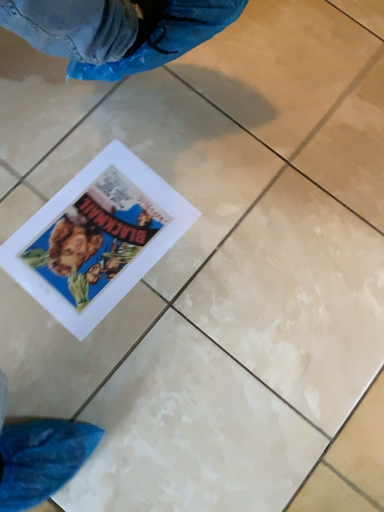
Locate an element on the screen. Image resolution: width=384 pixels, height=512 pixels. vacant region above blue matte poster at center (from a real-world perspective) is located at coordinates (95, 225).